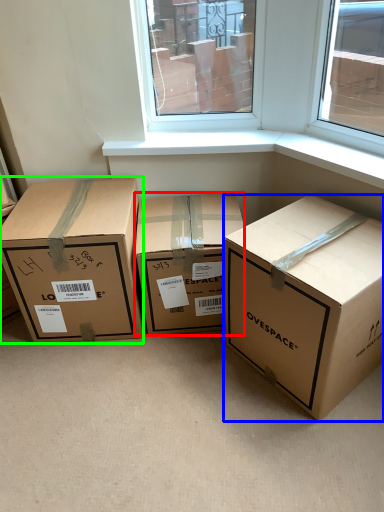
Question: Considering the real-world distances, which object is farthest from box (highlighted by a red box)? box (highlighted by a blue box) or box (highlighted by a green box)?

Choices:
 (A) box
 (B) box

Answer: (A)